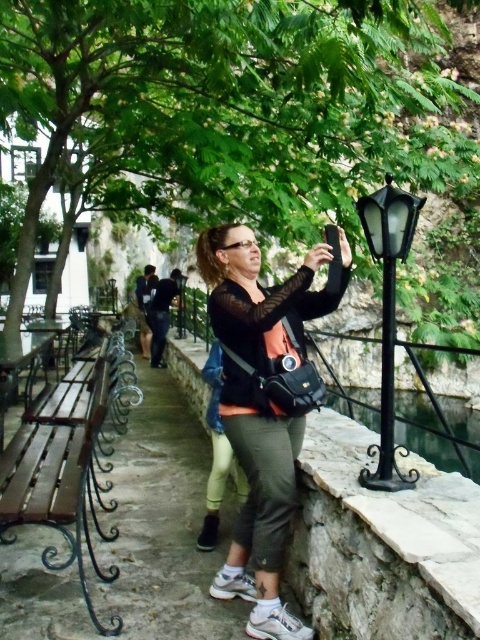
You are a photographer trying to capture a clear shot of the wooden bench at left. You have a matte black camera at center. Since the bench is behind the camera, can you adjust your position to include both the bench and the camera in the frame without moving either object?

The wooden bench at left is behind the matte black camera at center, so you can position yourself to the side of the camera so that both the bench and the camera are visible in the frame without moving either object.

You are an observer looking at the scene. Which object is taller between the green leafy tree at upper center and the green fabric pants at center?

The green leafy tree at upper center is taller than the green fabric pants at center.